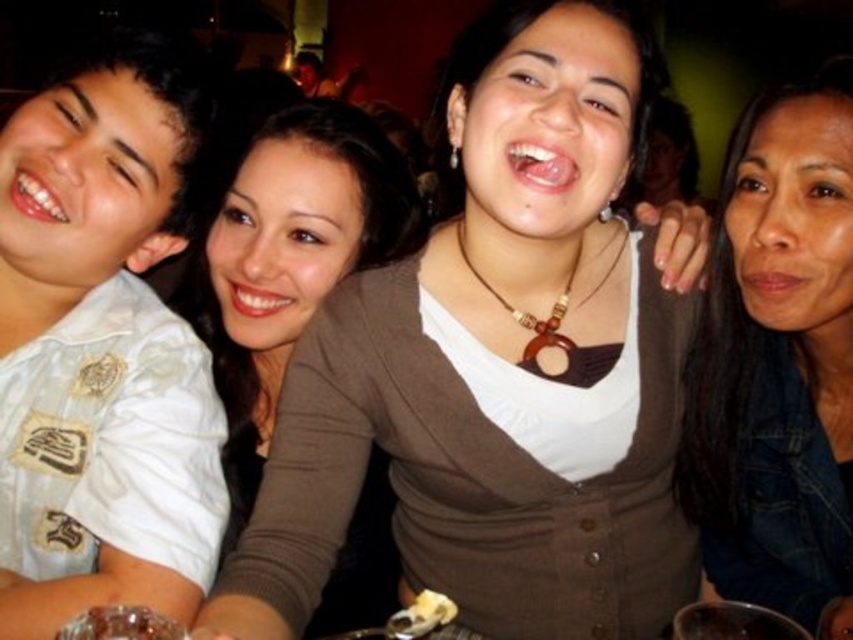
Question: Which of the following is the closest to the observer?

Choices:
 (A) (711, 531)
 (B) (381, 147)

Answer: (A)

Question: Is denim jacket at lower right to the left of brown matte sweater at center from the viewer's perspective?

Choices:
 (A) no
 (B) yes

Answer: (A)

Question: Is denim jacket at lower right further to camera compared to brown matte sweater at center?

Choices:
 (A) no
 (B) yes

Answer: (A)

Question: Among these objects, which one is nearest to the camera?

Choices:
 (A) denim jacket at lower right
 (B) brown matte sweater at center

Answer: (A)

Question: Is denim jacket at lower right wider than brown matte sweater at center?

Choices:
 (A) no
 (B) yes

Answer: (A)